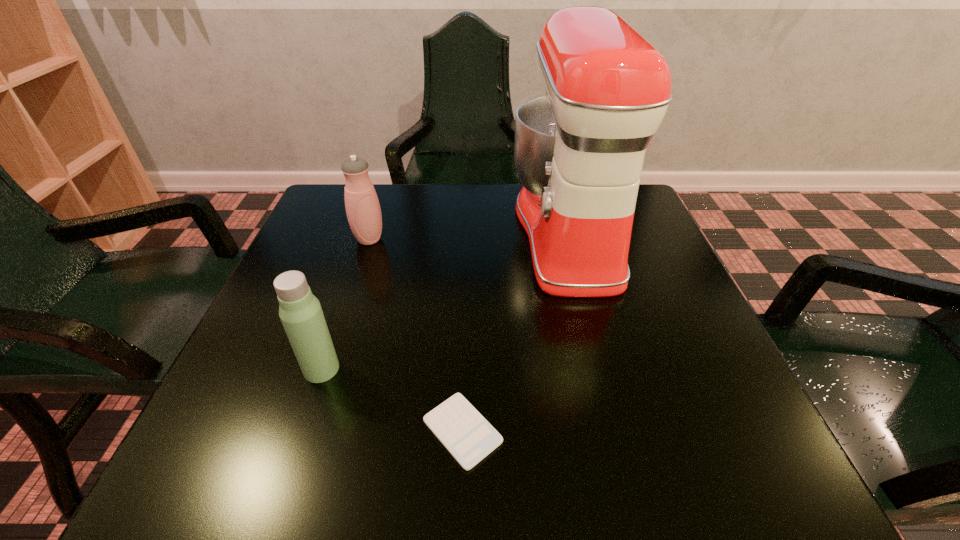
Identify the location of vacant space at the left edge of the desktop. (327, 254).

This screenshot has width=960, height=540. Identify the location of vacant area at the right edge of the desktop. (x=653, y=310).

Identify the location of blank space at the far left corner of the desktop. This screenshot has height=540, width=960. (332, 215).

What are the coordinates of `vacant position at the near left corner of the desktop` in the screenshot? It's located at (313, 424).

Locate an element on the screen. This screenshot has height=540, width=960. unoccupied position between the mixer and the farther thermos bottle is located at coordinates (468, 237).

Identify the location of free space that is in between the nearer thermos bottle and the farther thermos bottle. (346, 304).

You are a GUI agent. You are given a task and a screenshot of the screen. Output one action in this format:
    pyautogui.click(x=<x>, y=<y>)
    Task: Click on the blank region between the nearest object and the rightmost object
    The height and width of the screenshot is (540, 960).
    Given the screenshot: What is the action you would take?
    pyautogui.click(x=516, y=332)

Image resolution: width=960 pixels, height=540 pixels. In order to click on free space between the shortest object and the farther thermos bottle in this screenshot , I will do `click(416, 335)`.

The height and width of the screenshot is (540, 960). What are the coordinates of `free space between the shortest object and the tallest object` in the screenshot? It's located at (516, 332).

Image resolution: width=960 pixels, height=540 pixels. In order to click on empty space that is in between the shortest object and the nearer thermos bottle in this screenshot , I will do `click(392, 400)`.